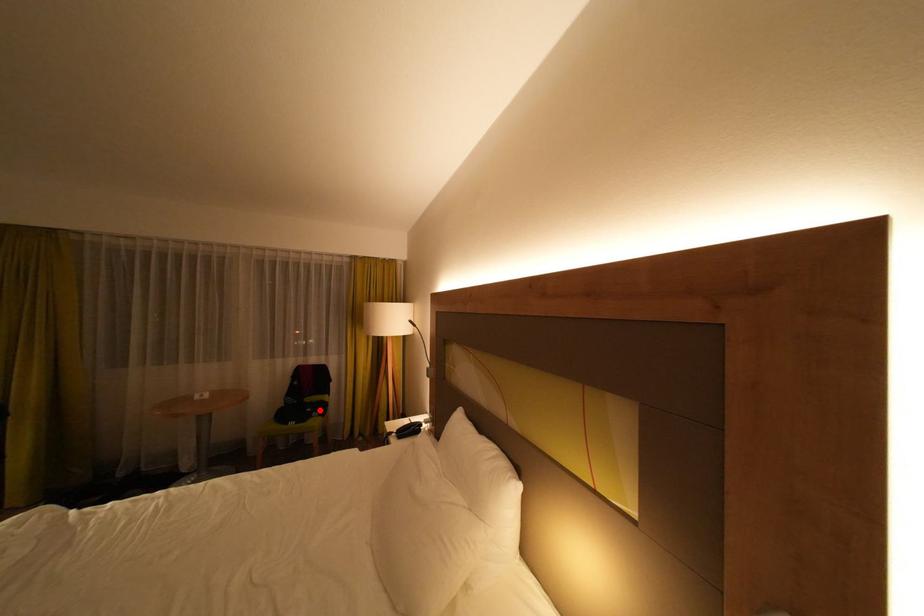
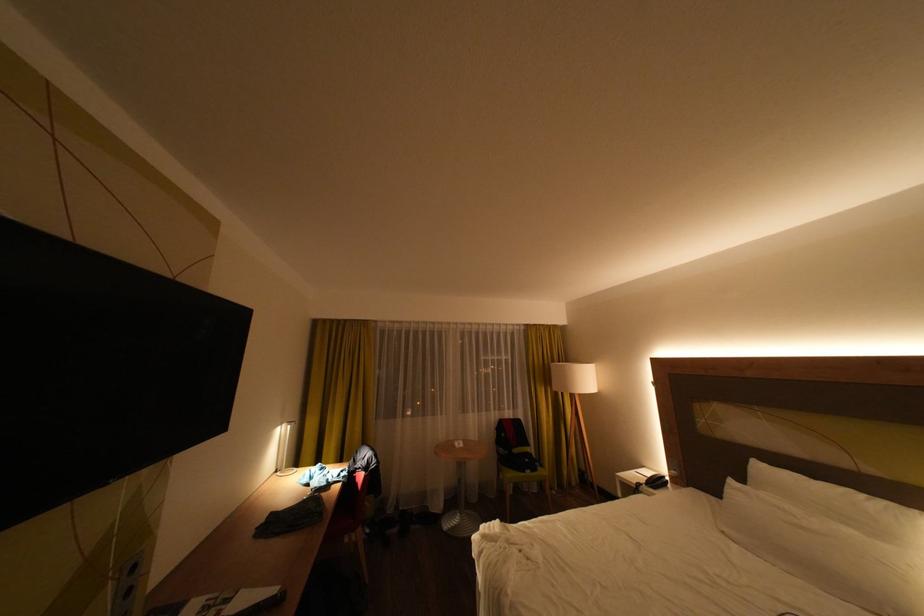
Question: I am providing you with two images of the same scene from different viewpoints. A red point is shown in image1. For the corresponding object point in image2, is it positioned nearer or farther from the camera?

Choices:
 (A) Nearer
 (B) Farther

Answer: (B)